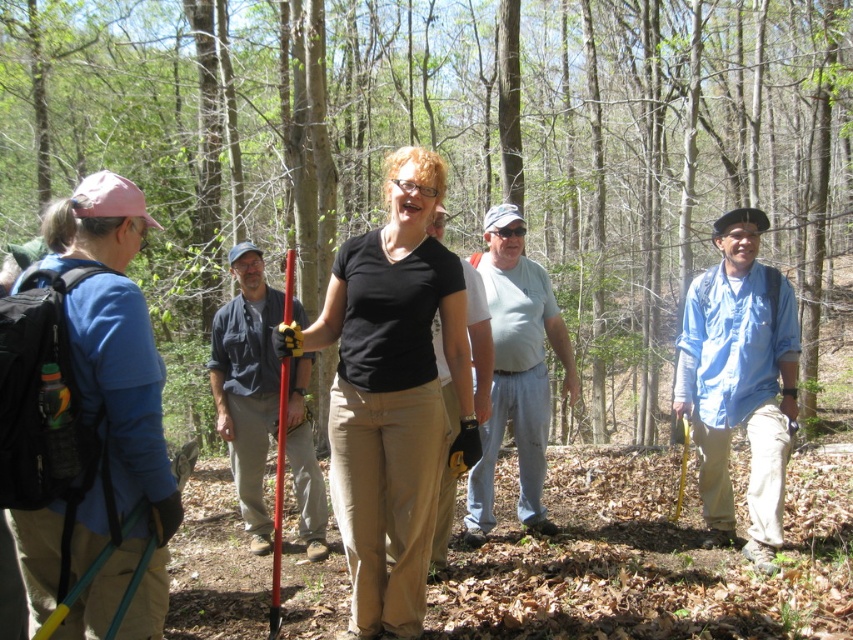
You are a photographer trying to capture a photo of the group. You want to ensure both the blue cotton shirt at right and the black cotton shirt at center are clearly visible in the frame. Based on their positions, which shirt should you focus on first to ensure both are in the shot?

The blue cotton shirt at right is to the right of the black cotton shirt at center. To ensure both are in the shot, focus on the black cotton shirt at center first as it is centrally located and the blue cotton shirt at right is positioned to its right, so framing from the center outward would capture both.

You are part of a hiking group and need to determine clothing sizes for a team photo. If the black matte shirt at center is wider than the blue cotton shirt at right, which shirt would you choose for a larger size tag?

The black matte shirt at center is wider than the blue cotton shirt at right, so you should choose the black matte shirt at center for a larger size tag.